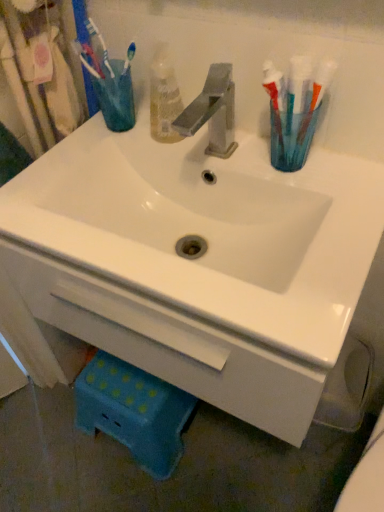
This screenshot has height=512, width=384. Identify the location of vacant space in front of translucent plastic toothbrush holder at upper right, which appears as the first turquoise when ordered from the bottom. (328, 219).